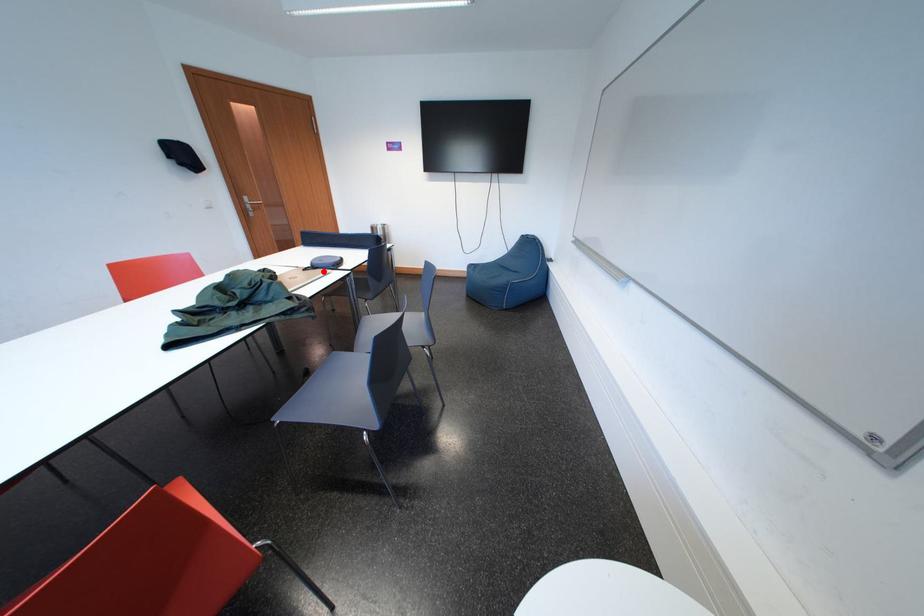
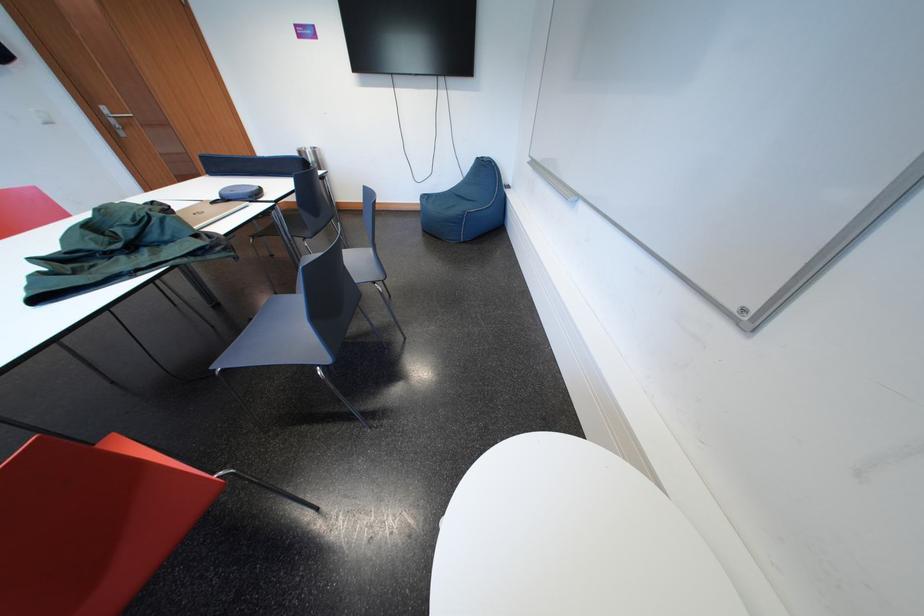
The point at the highlighted location is marked in the first image. Where is the corresponding point in the second image?

(235, 204)